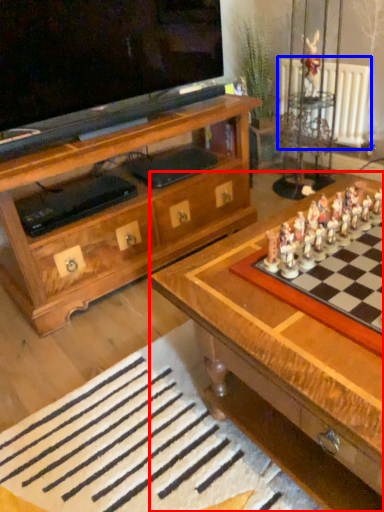
Question: Which object is further to the camera taking this photo, table (highlighted by a red box) or radiator (highlighted by a blue box)?

Choices:
 (A) table
 (B) radiator

Answer: (B)